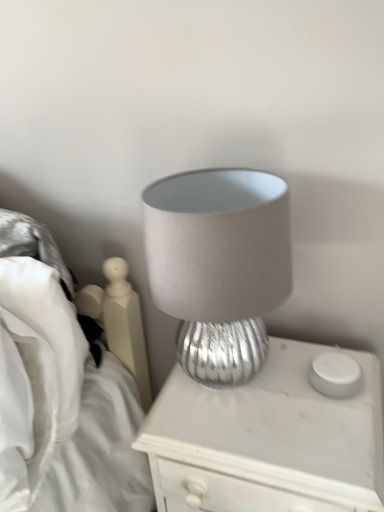
Question: Considering the positions of satin gray lampshade at center and white matte candle holder at right in the image, is satin gray lampshade at center taller or shorter than white matte candle holder at right?

Choices:
 (A) short
 (B) tall

Answer: (B)

Question: Based on their positions, is satin gray lampshade at center located to the left or right of white matte candle holder at right?

Choices:
 (A) left
 (B) right

Answer: (A)

Question: Estimate the real-world distances between objects in this image. Which object is farther from the satin gray lampshade at center?

Choices:
 (A) white matte candle holder at right
 (B) silver textured lamp at center

Answer: (A)

Question: Which is nearer to the silver textured lamp at center?

Choices:
 (A) white matte candle holder at right
 (B) satin gray lampshade at center

Answer: (A)